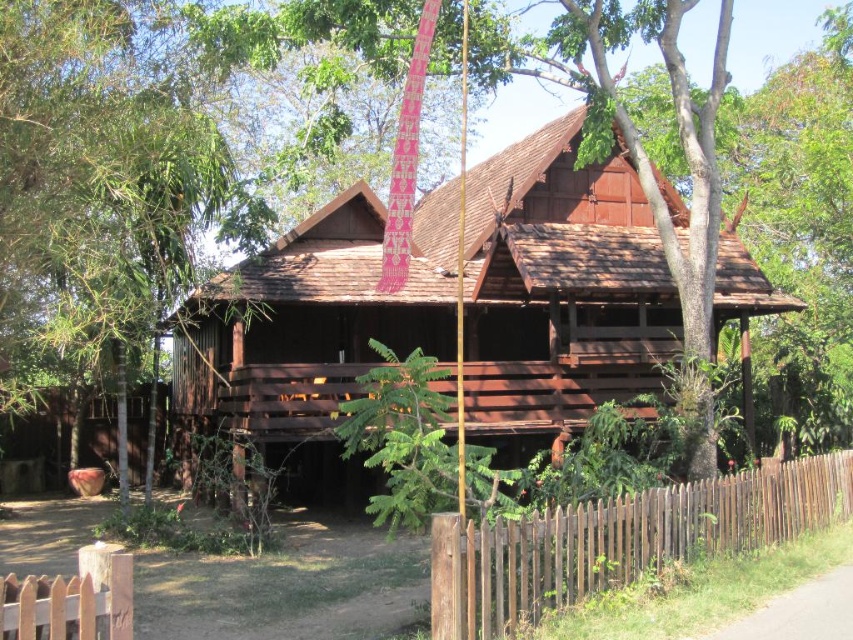
Between point (329, 244) and point (115, 598), which one is positioned behind?

The point (329, 244) is behind.

Does brown wooden hut at center appear on the left side of brown wooden fence at lower left?

In fact, brown wooden hut at center is to the right of brown wooden fence at lower left.

Does point (392, 310) come in front of point (30, 611)?

No, it is not.

You are a GUI agent. You are given a task and a screenshot of the screen. Output one action in this format:
    pyautogui.click(x=<x>, y=<y>)
    Task: Click on the brown wooden hut at center
    
    Given the screenshot: What is the action you would take?
    pyautogui.click(x=560, y=289)

How much distance is there between brown wooden hut at center and brown wooden fence at lower right?

27.55 feet

From the picture: Can you confirm if brown wooden hut at center is positioned below brown wooden fence at lower right?

No, brown wooden hut at center is not below brown wooden fence at lower right.

Locate an element on the screen. This screenshot has width=853, height=640. brown wooden hut at center is located at coordinates (560, 289).

Is brown wooden fence at lower right taller than brown wooden fence at lower left?

Indeed, brown wooden fence at lower right has a greater height compared to brown wooden fence at lower left.

Is brown wooden fence at lower right shorter than brown wooden fence at lower left?

No, brown wooden fence at lower right is not shorter than brown wooden fence at lower left.

Find the location of a particular element. The image size is (853, 640). brown wooden fence at lower right is located at coordinates (618, 540).

Locate an element on the screen. This screenshot has width=853, height=640. brown wooden fence at lower right is located at coordinates (618, 540).